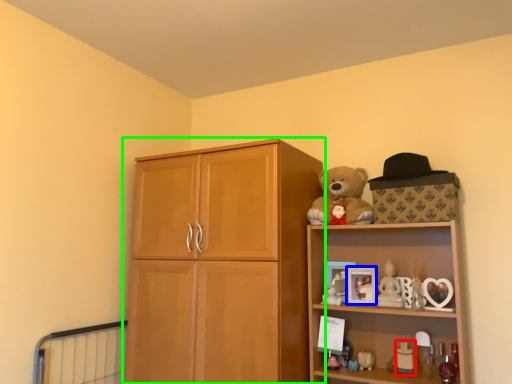
Question: Which is nearer to the toy (highlighted by a red box)? picture frame (highlighted by a blue box) or cupboard (highlighted by a green box).

Choices:
 (A) picture frame
 (B) cupboard

Answer: (A)